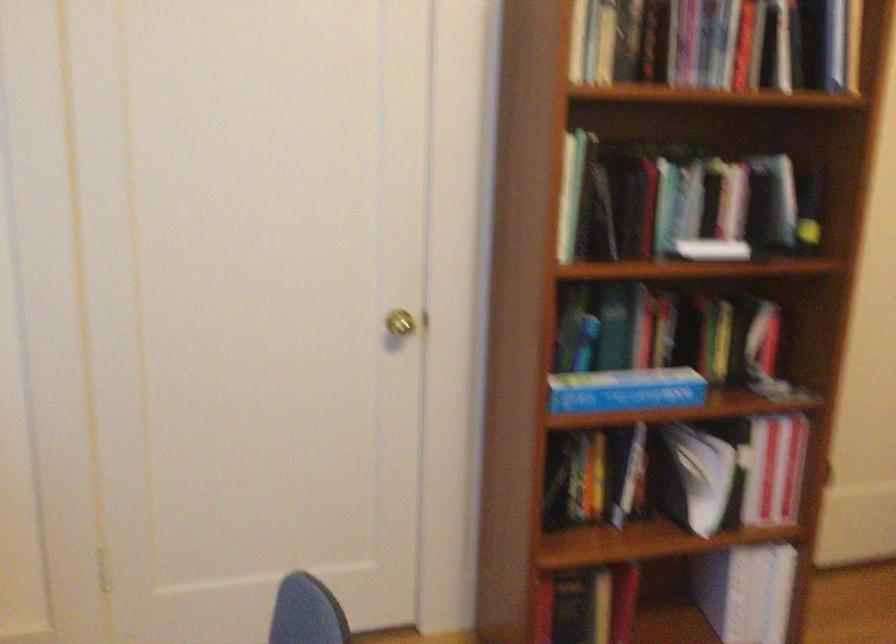
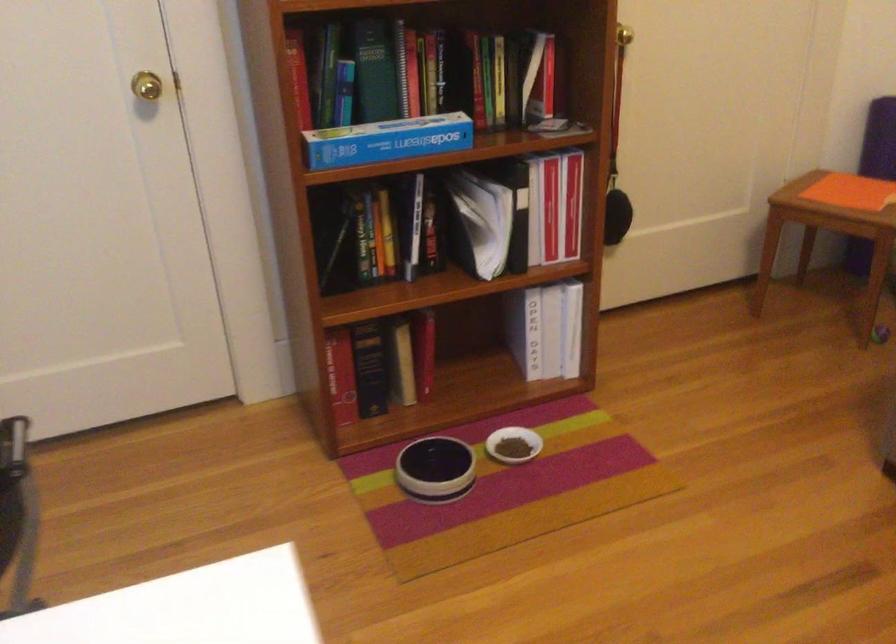
The point at (622, 393) is marked in the first image. Where is the corresponding point in the second image?

(386, 140)